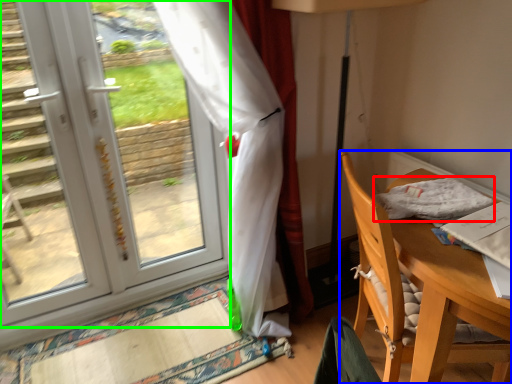
Question: Which object is the farthest from cloth (highlighted by a red box)? Choose among these: chair (highlighted by a blue box) or door (highlighted by a green box).

Choices:
 (A) chair
 (B) door

Answer: (B)